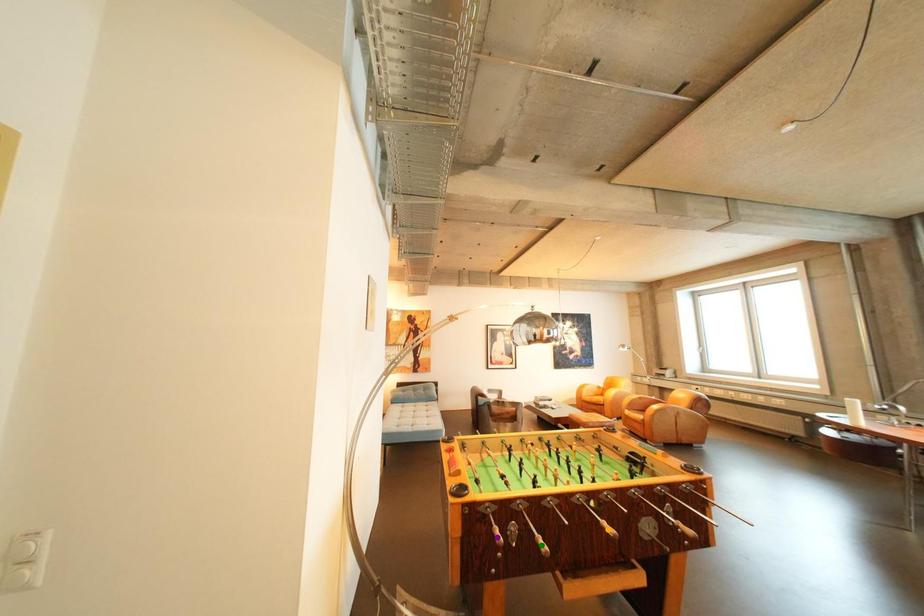
Order these from nearest to farthest:
green point | purple point | orange point

green point → orange point → purple point